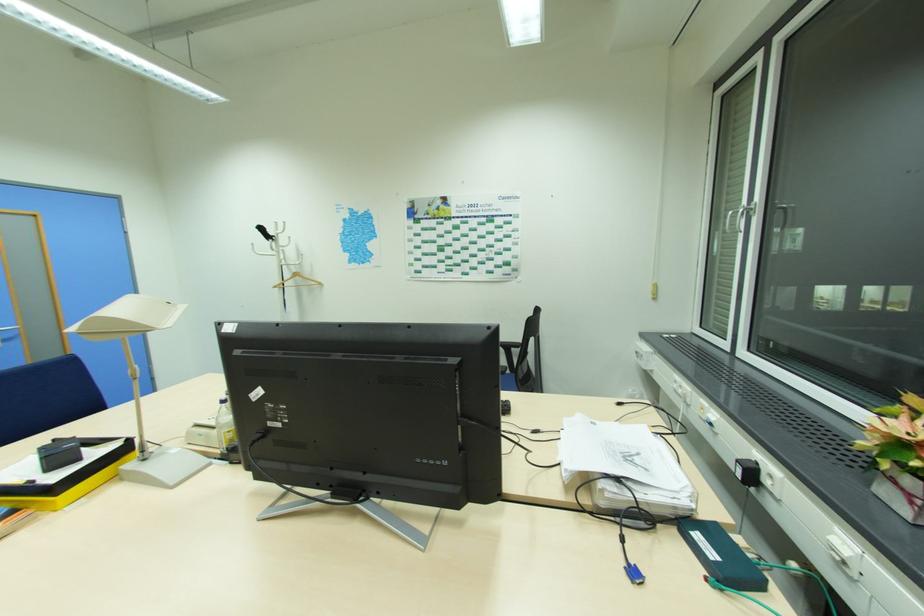
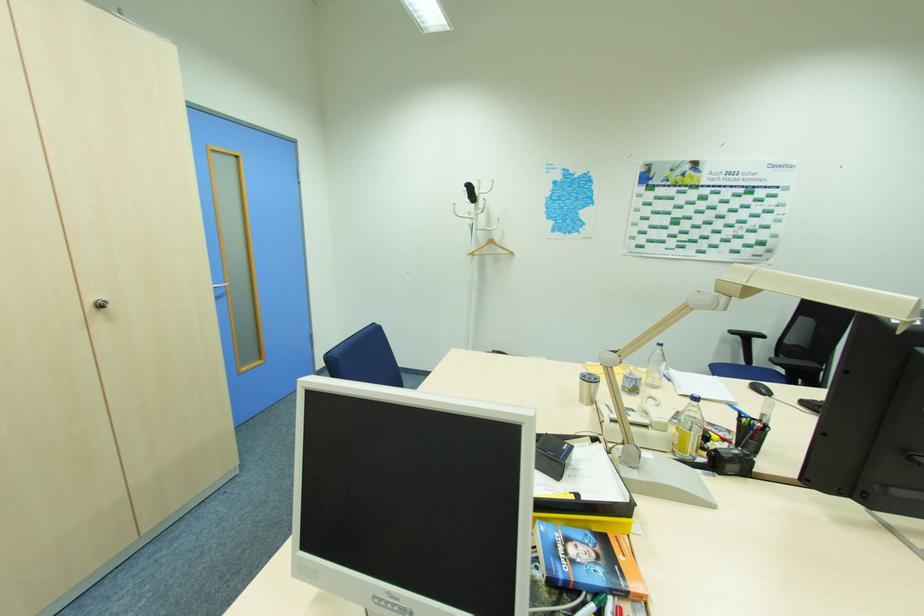
In the second image, find the point that corresponds to point 263,229 in the first image.

(472, 188)